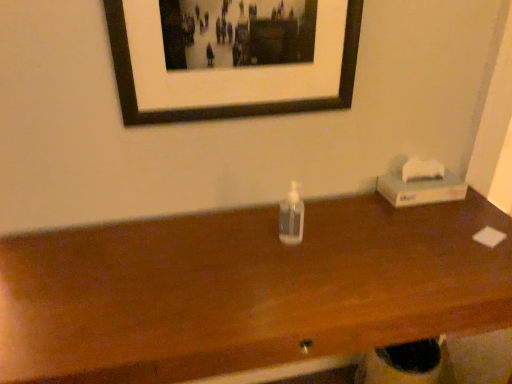
Question: From the image's perspective, would you say black matte picture frame at upper center is positioned over white cardboard tissue box at right?

Choices:
 (A) yes
 (B) no

Answer: (A)

Question: Does black matte picture frame at upper center have a lesser width compared to white cardboard tissue box at right?

Choices:
 (A) no
 (B) yes

Answer: (B)

Question: Considering the relative sizes of black matte picture frame at upper center and white cardboard tissue box at right in the image provided, is black matte picture frame at upper center wider than white cardboard tissue box at right?

Choices:
 (A) no
 (B) yes

Answer: (A)

Question: Is black matte picture frame at upper center outside of white cardboard tissue box at right?

Choices:
 (A) yes
 (B) no

Answer: (A)

Question: From a real-world perspective, is black matte picture frame at upper center on white cardboard tissue box at right?

Choices:
 (A) no
 (B) yes

Answer: (B)

Question: In the image, is white cardboard tissue box at right positioned in front of or behind black matte picture frame at upper center?

Choices:
 (A) front
 (B) behind

Answer: (B)

Question: Considering the positions of white cardboard tissue box at right and black matte picture frame at upper center in the image, is white cardboard tissue box at right bigger or smaller than black matte picture frame at upper center?

Choices:
 (A) big
 (B) small

Answer: (B)

Question: From the image's perspective, is white cardboard tissue box at right above or below black matte picture frame at upper center?

Choices:
 (A) above
 (B) below

Answer: (B)

Question: Is white cardboard tissue box at right to the left or to the right of black matte picture frame at upper center in the image?

Choices:
 (A) left
 (B) right

Answer: (B)

Question: In terms of size, does transparent plastic bottle at center appear bigger or smaller than transparent plastic bottle at center?

Choices:
 (A) big
 (B) small

Answer: (B)

Question: Considering the positions of transparent plastic bottle at center and transparent plastic bottle at center in the image, is transparent plastic bottle at center wider or thinner than transparent plastic bottle at center?

Choices:
 (A) thin
 (B) wide

Answer: (A)

Question: In the image, is transparent plastic bottle at center positioned in front of or behind transparent plastic bottle at center?

Choices:
 (A) front
 (B) behind

Answer: (B)

Question: From a real-world perspective, is transparent plastic bottle at center positioned above or below transparent plastic bottle at center?

Choices:
 (A) below
 (B) above

Answer: (B)

Question: Is transparent plastic bottle at center wider or thinner than transparent plastic bottle at center?

Choices:
 (A) thin
 (B) wide

Answer: (B)

Question: From a real-world perspective, is transparent plastic bottle at center physically located above or below transparent plastic bottle at center?

Choices:
 (A) above
 (B) below

Answer: (B)